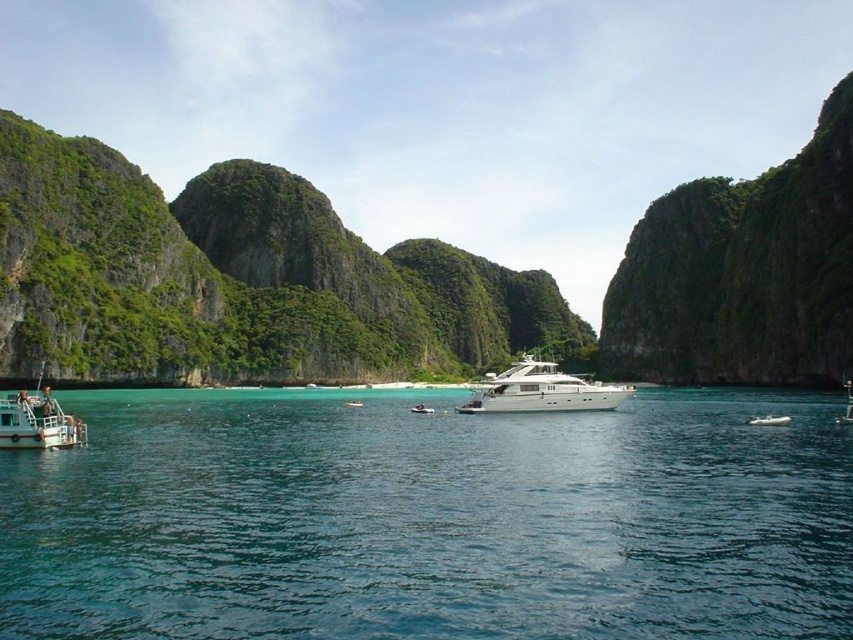
You are a photographer planning to take a photo of the white glossy yacht at center and the white glossy motorboat at center. Since both are white, you want to ensure they are distinguishable in the photo. Based on their positions, which one should you focus on first to frame them properly?

The white glossy yacht at center is positioned on the left side of the white glossy motorboat at center, so focusing on the yacht first will help frame both objects properly by starting from the left and moving right.

You are a marine biologist planning to anchor your research vessel near the white glossy yacht at center. According to the coordinates provided, where should you position your vessel to ensure it remains within the same general area as the yacht?

The white glossy yacht at center is located at point (x=541, y=390), so you should position your vessel near those coordinates to stay in the same general area.